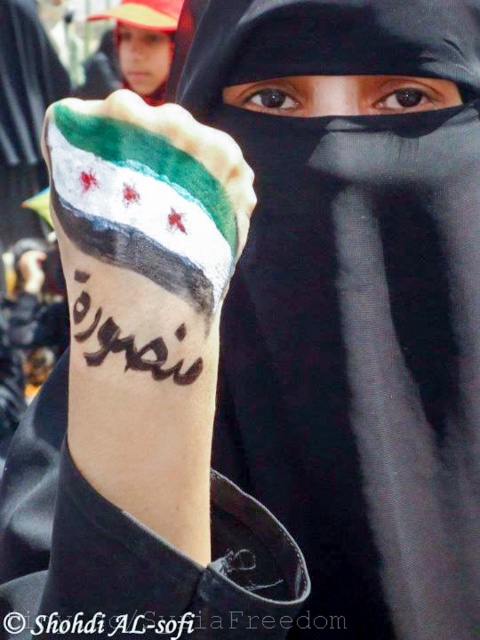
The image size is (480, 640). I want to click on black matte niqab at center, so click(x=343, y=96).

Can you confirm if black matte niqab at center is positioned to the left of smooth skin face at upper left?

In fact, black matte niqab at center is to the right of smooth skin face at upper left.

Who is more forward, (x=239, y=90) or (x=155, y=92)?

Point (x=239, y=90)

Locate an element on the screen. black matte niqab at center is located at coordinates (343, 96).

Is the position of black ink writing at center less distant than that of black matte niqab at center?

Yes, it is in front of black matte niqab at center.

Can you confirm if black ink writing at center is thinner than black matte niqab at center?

No.

Where is `black ink writing at center`? The image size is (480, 640). black ink writing at center is located at coordinates (144, 625).

Is black ink writing at center in front of smooth skin face at upper left?

Yes.

Is black ink writing at center shorter than smooth skin face at upper left?

Correct, black ink writing at center is not as tall as smooth skin face at upper left.

Identify the location of black ink writing at center. (144, 625).